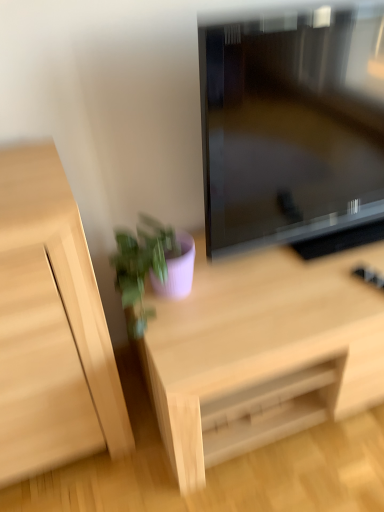
Question: Can you confirm if matte purple pot at lower center is positioned to the right of light wood cabinet at left?

Choices:
 (A) yes
 (B) no

Answer: (A)

Question: Is the surface of matte purple pot at lower center in direct contact with light wood cabinet at left?

Choices:
 (A) no
 (B) yes

Answer: (A)

Question: Are matte purple pot at lower center and light wood cabinet at left far apart?

Choices:
 (A) yes
 (B) no

Answer: (B)

Question: From the image's perspective, is matte purple pot at lower center on top of light wood cabinet at left?

Choices:
 (A) yes
 (B) no

Answer: (A)

Question: Does matte purple pot at lower center have a greater width compared to light wood cabinet at left?

Choices:
 (A) yes
 (B) no

Answer: (B)

Question: Is matte purple pot at lower center smaller than light wood cabinet at left?

Choices:
 (A) yes
 (B) no

Answer: (A)

Question: Considering the relative sizes of matte black television at center and light wood desk at center in the image provided, is matte black television at center taller than light wood desk at center?

Choices:
 (A) no
 (B) yes

Answer: (B)

Question: Is matte black television at center with light wood desk at center?

Choices:
 (A) no
 (B) yes

Answer: (A)

Question: Can you confirm if matte black television at center is positioned to the right of light wood desk at center?

Choices:
 (A) no
 (B) yes

Answer: (A)

Question: From the image's perspective, does matte black television at center appear higher than light wood desk at center?

Choices:
 (A) yes
 (B) no

Answer: (A)

Question: Is matte black television at center wider than light wood desk at center?

Choices:
 (A) no
 (B) yes

Answer: (A)

Question: Is light wood desk at center inside matte black television at center?

Choices:
 (A) yes
 (B) no

Answer: (B)

Question: Does light wood cabinet at left lie in front of light wood desk at center?

Choices:
 (A) yes
 (B) no

Answer: (A)